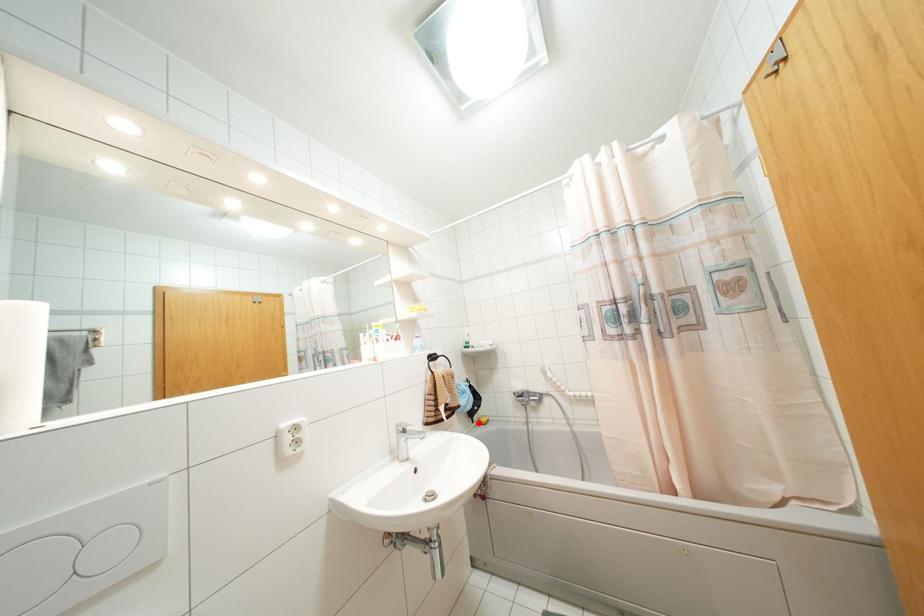
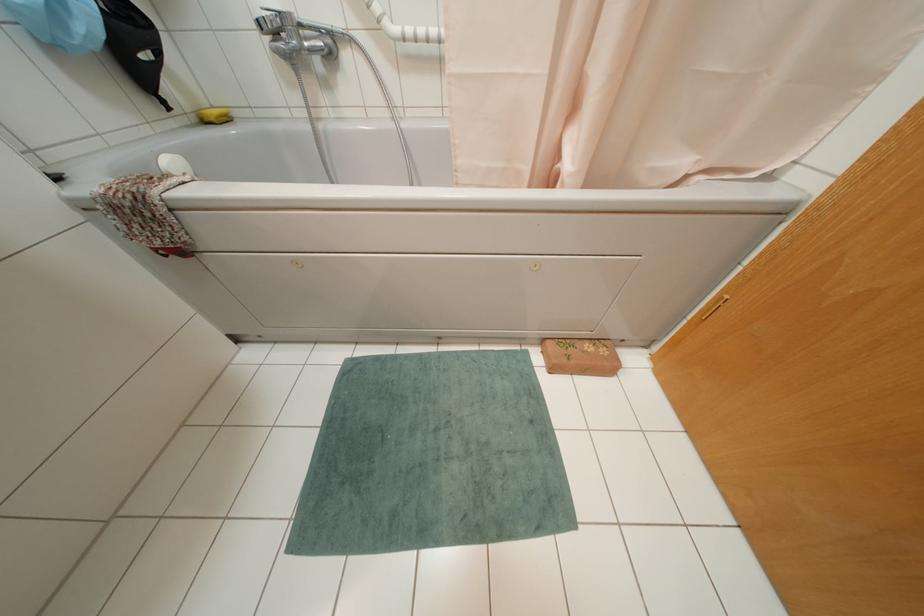
Where in the second image is the point corresponding to the highlighted location from the first image?

(202, 121)